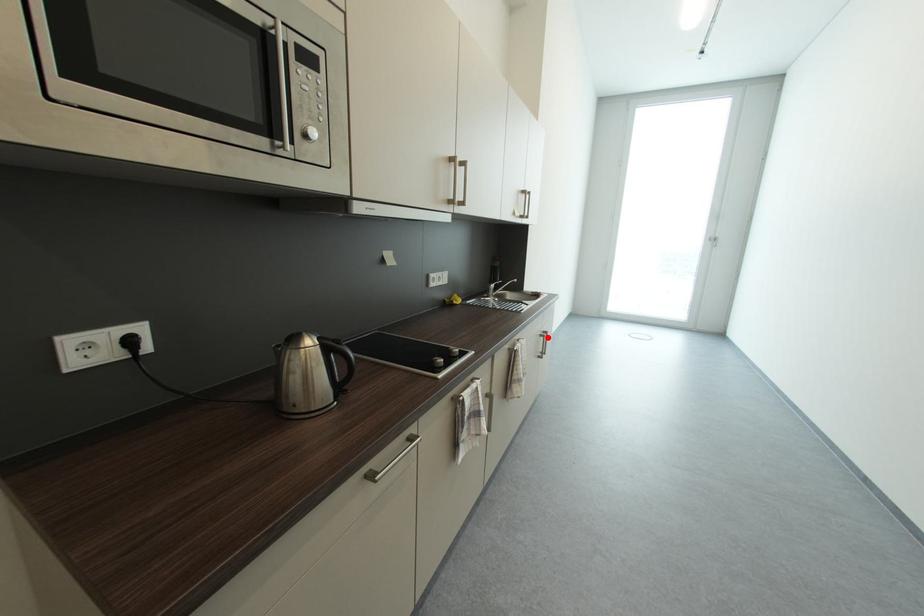
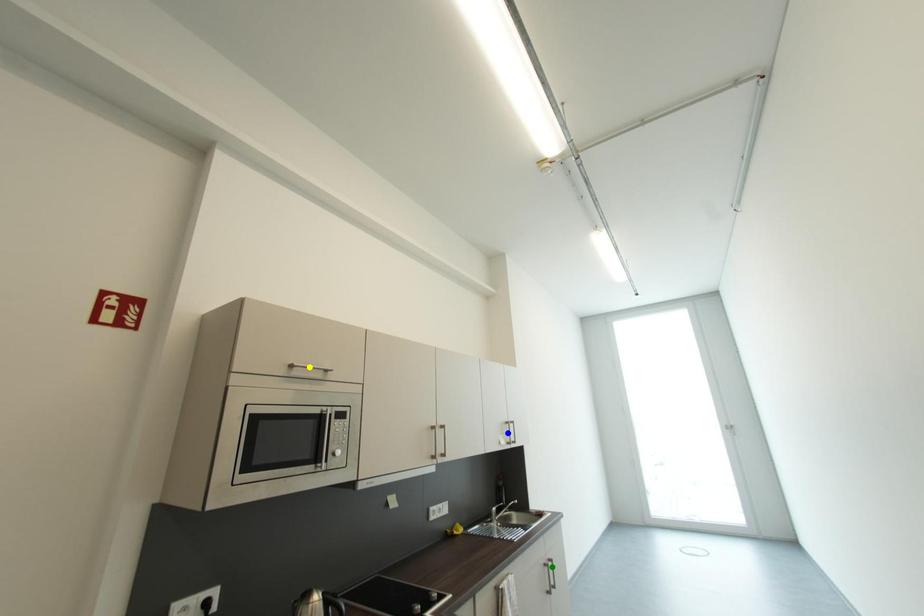
Question: I am providing you with two images of the same scene from different viewpoints. A red point is marked on the first image. You are given multiple points on the second image. Which point in image 2 is actually the same real-world point as the red point in image 1?

Choices:
 (A) blue point
 (B) green point
 (C) yellow point

Answer: (B)